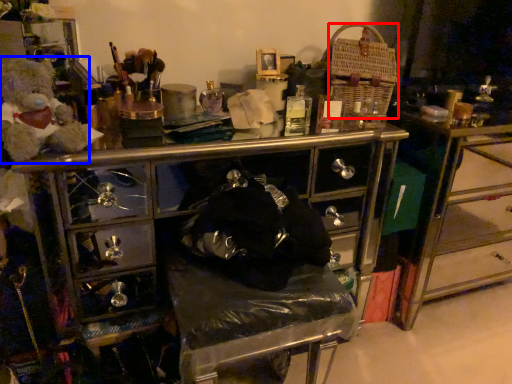
Question: Among these objects, which one is farthest to the camera, crate (highlighted by a red box) or teddy (highlighted by a blue box)?

Choices:
 (A) crate
 (B) teddy

Answer: (A)